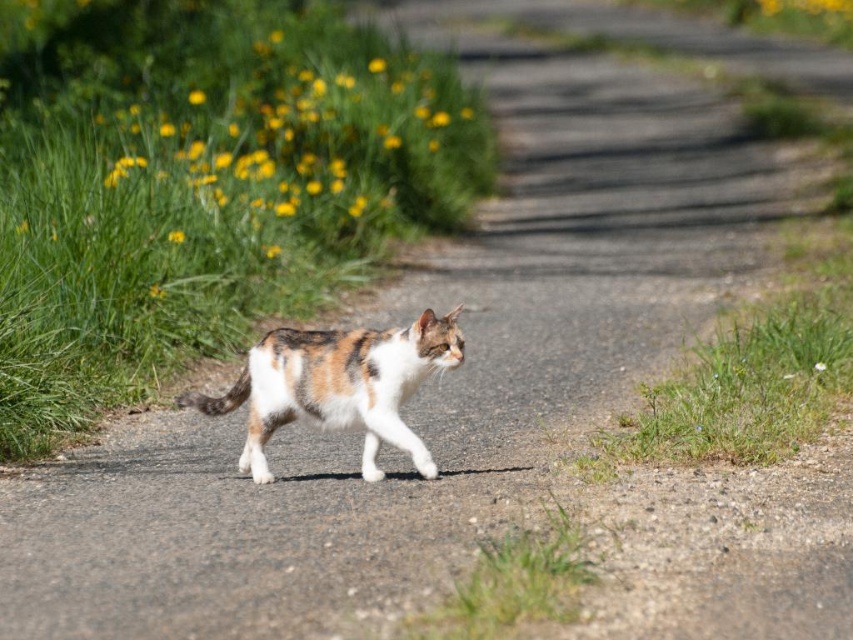
You are a photographer trying to capture the cat walking along the path. You notice the yellow grass at upper left and the white matte flower at center in your viewfinder. Which object should you focus on to ensure the subject in the foreground is sharp?

The yellow grass at upper left is much taller than the white matte flower at center, so focusing on the yellow grass at upper left would ensure the foreground subject is sharp.

You are a photographer aiming to capture the cat walking along the path. You notice the yellow grass at upper left and the white matte flower at center. Which object is located higher in the image?

The yellow grass at upper left is positioned over the white matte flower at center, meaning it is higher in the image.

You are a photographer trying to capture the calico fur cat at center. You want to focus on the exact point at coordinates point (337, 385). Is this point located on the cat?

Yes, the point (337, 385) is on the calico fur cat at center, so the focus will be on the cat.